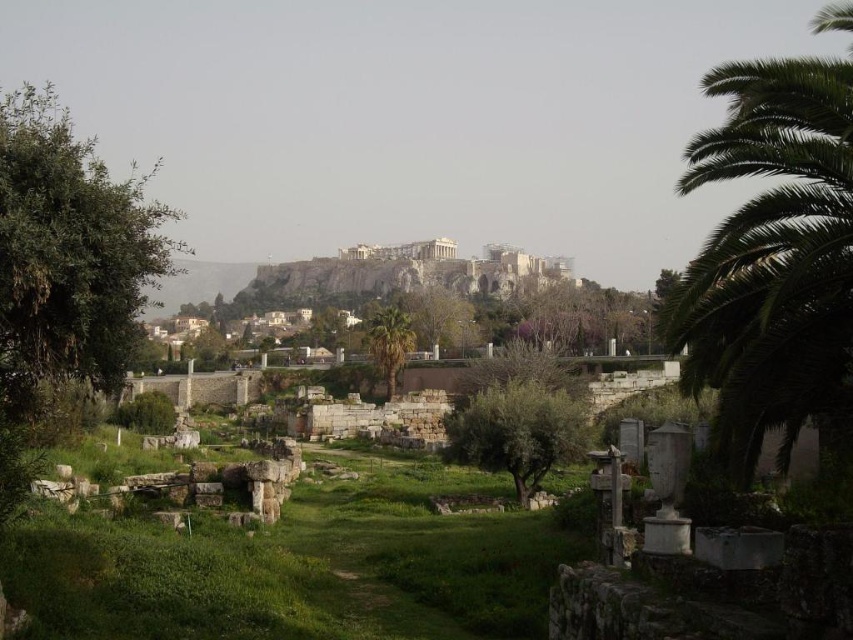
You are standing at the ancient Agora looking towards the Acropolis. You notice a green leafy palm at right. Based on its 2D location coordinates, can you determine if it is closer to the Agora or the Acropolis?

The green leafy palm at right is located at coordinates (x=772, y=259). Since the Agora is in the foreground and the Acropolis is in the mid to background, the palm tree is closer to the Agora as its coordinates place it towards the right edge but still within the foreground area.

You are standing at the ancient Agora looking towards the Acropolis. You notice two points marked in the scene. Which point, point (753, 273) or point (45, 385), is closer to you?

Point (753, 273) is closer to you than point (45, 385).

You are standing at the ancient Agora looking towards the Acropolis. You notice two points marked on the ground in front of you. The first point is at coordinate (135, 208) and the second is at (462, 422). Which of these two points is closer to your current position?

Point (135, 208) is closer to the viewer than point (462, 422), so the first point is closer to your current position.